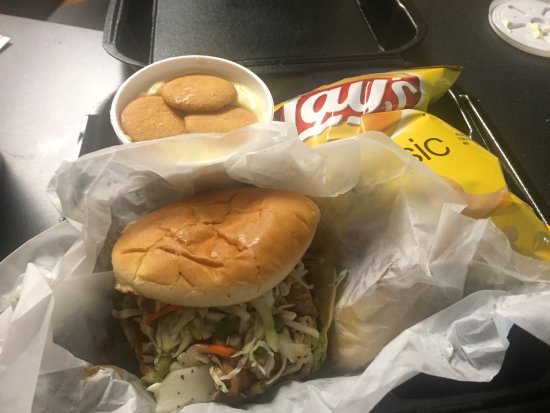
Image resolution: width=550 pixels, height=413 pixels. What are the coordinates of `ebony table` in the screenshot? It's located at (478, 60).